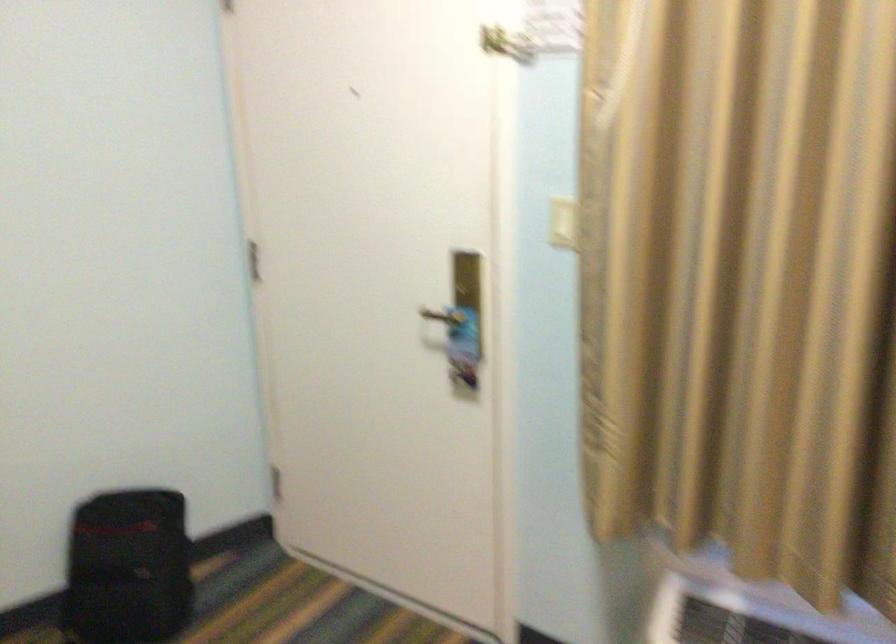
Where is `metal door handle`? metal door handle is located at coordinates (462, 322).